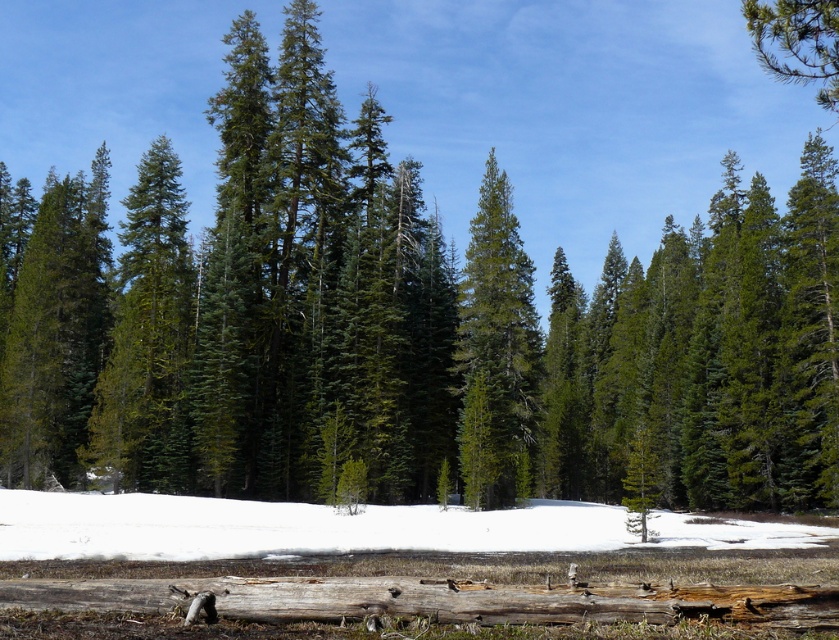
Question: Which point is closer to the camera taking this photo?

Choices:
 (A) (769, 16)
 (B) (155, 529)

Answer: (A)

Question: Can you confirm if white fluffy snow at lower center is positioned above green needle-like tree at upper right?

Choices:
 (A) yes
 (B) no

Answer: (B)

Question: Which of the following is the closest to the observer?

Choices:
 (A) (772, 48)
 (B) (517, 269)
 (C) (743, 524)

Answer: (A)

Question: Does white fluffy snow at lower center have a larger size compared to green matte tree at center?

Choices:
 (A) yes
 (B) no

Answer: (A)

Question: Which point is closer to the camera?

Choices:
 (A) white fluffy snow at lower center
 (B) green matte tree at center
 (C) green needle-like tree at upper right

Answer: (C)

Question: Can you confirm if white fluffy snow at lower center is positioned to the left of green needle-like tree at upper right?

Choices:
 (A) yes
 (B) no

Answer: (A)